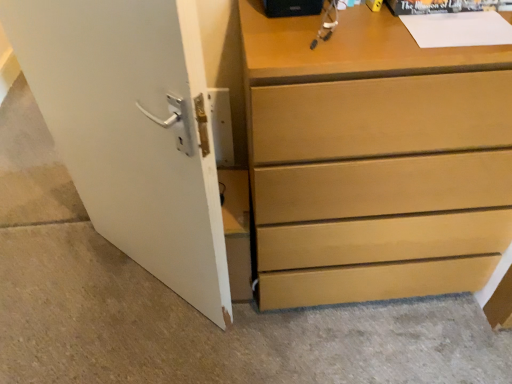
Locate an element on the screen. This screenshot has height=384, width=512. white matte door at left is located at coordinates (133, 130).

What do you see at coordinates (133, 130) in the screenshot?
I see `white matte door at left` at bounding box center [133, 130].

At what (x,y) coordinates should I click in order to perform the action: click on matte wood chest of drawers at center. Please return your answer as a coordinate pair (x, y). Looking at the image, I should click on (374, 160).

What do you see at coordinates (374, 160) in the screenshot? This screenshot has width=512, height=384. I see `matte wood chest of drawers at center` at bounding box center [374, 160].

From the picture: In order to face matte wood chest of drawers at center, should I rotate leftwards or rightwards?

You should rotate right by 15.367 degrees.

At what (x,y) coordinates should I click in order to perform the action: click on white matte door at left. Please return your answer as a coordinate pair (x, y). This screenshot has height=384, width=512. Looking at the image, I should click on (133, 130).

Is white matte door at left at the left side of matte wood chest of drawers at center?

Indeed, white matte door at left is positioned on the left side of matte wood chest of drawers at center.

Consider the image. Considering the positions of objects white matte door at left and matte wood chest of drawers at center in the image provided, who is in front, white matte door at left or matte wood chest of drawers at center?

white matte door at left.

Does point (92, 21) come farther from viewer compared to point (307, 116)?

No, it is in front of (307, 116).

From the image's perspective, which object appears higher, white matte door at left or matte wood chest of drawers at center?

From the image's view, matte wood chest of drawers at center is above.

From a real-world perspective, is white matte door at left on matte wood chest of drawers at center?

Yes, from a real-world perspective, white matte door at left is over matte wood chest of drawers at center

Considering the sizes of white matte door at left and matte wood chest of drawers at center in the image, is white matte door at left wider or thinner than matte wood chest of drawers at center?

In the image, white matte door at left appears to be more narrow than matte wood chest of drawers at center.

Who is shorter, white matte door at left or matte wood chest of drawers at center?

Standing shorter between the two is matte wood chest of drawers at center.

Which of these two, white matte door at left or matte wood chest of drawers at center, is bigger?

Bigger between the two is matte wood chest of drawers at center.

Is white matte door at left outside of matte wood chest of drawers at center?

Yes.

Is white matte door at left next to matte wood chest of drawers at center and touching it?

No, white matte door at left is not in contact with matte wood chest of drawers at center.

Could you tell me if white matte door at left is turned towards matte wood chest of drawers at center?

No, white matte door at left is not oriented towards matte wood chest of drawers at center.

How many degrees apart are the facing directions of white matte door at left and matte wood chest of drawers at center?

44.3 degrees separate the facing orientations of white matte door at left and matte wood chest of drawers at center.

The height and width of the screenshot is (384, 512). What are the coordinates of `chest of drawers above the white matte door at left (from the image's perspective)` in the screenshot? It's located at (374, 160).

Does matte wood chest of drawers at center appear on the left side of white matte door at left?

In fact, matte wood chest of drawers at center is to the right of white matte door at left.

Between matte wood chest of drawers at center and white matte door at left, which one is positioned behind?

matte wood chest of drawers at center.

Considering the points (404, 37) and (118, 63), which point is behind, point (404, 37) or point (118, 63)?

The point (404, 37) is farther from the camera.

From the image's perspective, is matte wood chest of drawers at center over white matte door at left?

Yes.

From a real-world perspective, which object stands above the other?

In real-world perspective, white matte door at left is above.

Is matte wood chest of drawers at center wider than white matte door at left?

Indeed, matte wood chest of drawers at center has a greater width compared to white matte door at left.

Considering the sizes of objects matte wood chest of drawers at center and white matte door at left in the image provided, who is taller, matte wood chest of drawers at center or white matte door at left?

Standing taller between the two is white matte door at left.

Between matte wood chest of drawers at center and white matte door at left, which one has larger size?

matte wood chest of drawers at center is bigger.

Would you say matte wood chest of drawers at center is outside white matte door at left?

Yes, matte wood chest of drawers at center is outside of white matte door at left.

Are matte wood chest of drawers at center and white matte door at left making contact?

No.

Is matte wood chest of drawers at center positioned with its back to white matte door at left?

matte wood chest of drawers at center does not have its back to white matte door at left.

Based on the photo, how different are the orientations of matte wood chest of drawers at center and white matte door at left in degrees?

The angular difference between matte wood chest of drawers at center and white matte door at left is 44.3 degrees.

At what (x,y) coordinates should I click in order to perform the action: click on the chest of drawers lying above the white matte door at left (from the image's perspective). Please return your answer as a coordinate pair (x, y). This screenshot has height=384, width=512. Looking at the image, I should click on (374, 160).

Find the location of a particular element. door below the matte wood chest of drawers at center (from the image's perspective) is located at coordinates (133, 130).

You are a GUI agent. You are given a task and a screenshot of the screen. Output one action in this format:
    pyautogui.click(x=<x>, y=<y>)
    Task: Click on the chest of drawers behind the white matte door at left
    
    Given the screenshot: What is the action you would take?
    pyautogui.click(x=374, y=160)